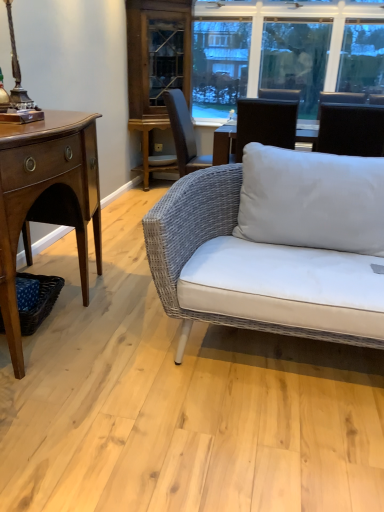
You are a GUI agent. You are given a task and a screenshot of the screen. Output one action in this format:
    pyautogui.click(x=<x>, y=<y>)
    Task: Click on the clear glass window at upper center
    This screenshot has height=512, width=384.
    Given the screenshot: What is the action you would take?
    pyautogui.click(x=274, y=49)

Locate an element on the screen. Image resolution: width=384 pixels, height=512 pixels. metallic bronze table lamp at upper left is located at coordinates coord(17,89).

Locate an element on the screen. mahogany wood desk at left is located at coordinates (46, 198).

What are the coordinates of `clear glass window at upper center` in the screenshot? It's located at (274, 49).

Is clear glass window at upper center wider or thinner than mahogany wood desk at left?

clear glass window at upper center is thinner than mahogany wood desk at left.

Is mahogany wood desk at left at the back of clear glass window at upper center?

No, mahogany wood desk at left is not at the back of clear glass window at upper center.

Who is taller, clear glass window at upper center or mahogany wood desk at left?

clear glass window at upper center is taller.

Measure the distance from clear glass window at upper center to mahogany wood desk at left.

clear glass window at upper center is 2.87 meters away from mahogany wood desk at left.

Is point (15, 104) positioned behind point (378, 108)?

No, it is in front of (378, 108).

Is metallic bronze table lamp at upper left in contact with black fabric chair at upper right?

No, metallic bronze table lamp at upper left is not touching black fabric chair at upper right.

Is metallic bronze table lamp at upper left oriented away from black fabric chair at upper right?

metallic bronze table lamp at upper left is not turned away from black fabric chair at upper right.

Considering the sizes of metallic bronze table lamp at upper left and black fabric chair at upper right in the image, is metallic bronze table lamp at upper left bigger or smaller than black fabric chair at upper right?

In the image, metallic bronze table lamp at upper left appears to be smaller than black fabric chair at upper right.

Is blue woven picnic basket at lower left at the right side of mahogany wood desk at left?

Yes.

You are a GUI agent. You are given a task and a screenshot of the screen. Output one action in this format:
    pyautogui.click(x=<x>, y=<y>)
    Task: Click on the desk above the blue woven picnic basket at lower left (from a real-world perspective)
    The height and width of the screenshot is (512, 384).
    Given the screenshot: What is the action you would take?
    pyautogui.click(x=46, y=198)

Can you confirm if blue woven picnic basket at lower left is smaller than mahogany wood desk at left?

Yes.

Is blue woven picnic basket at lower left looking in the opposite direction of mahogany wood desk at left?

Absolutely, blue woven picnic basket at lower left is directed away from mahogany wood desk at left.

Based on the photo, what's the angular difference between mahogany wood desk at left and metallic bronze table lamp at upper left's facing directions?

The facing directions of mahogany wood desk at left and metallic bronze table lamp at upper left are 0.000133 degrees apart.

Does mahogany wood desk at left touch metallic bronze table lamp at upper left?

No, mahogany wood desk at left is not making contact with metallic bronze table lamp at upper left.

Can you confirm if mahogany wood desk at left is bigger than metallic bronze table lamp at upper left?

Yes.

From a real-world perspective, is black fabric chair at upper right positioned over mahogany wood desk at left based on gravity?

Yes.

Find the location of `desk below the black fabric chair at upper right (from the image's perspective)`. desk below the black fabric chair at upper right (from the image's perspective) is located at coordinates pyautogui.click(x=46, y=198).

Is black fabric chair at upper right far from mahogany wood desk at left?

Absolutely, black fabric chair at upper right is distant from mahogany wood desk at left.

Considering the sizes of objects black fabric chair at upper right and mahogany wood desk at left in the image provided, who is bigger, black fabric chair at upper right or mahogany wood desk at left?

mahogany wood desk at left is bigger.

Measure the distance from metallic bronze table lamp at upper left to mahogany wood desk at left.

34.87 centimeters.

Who is smaller, metallic bronze table lamp at upper left or mahogany wood desk at left?

Smaller between the two is metallic bronze table lamp at upper left.

Does metallic bronze table lamp at upper left turn towards mahogany wood desk at left?

No, metallic bronze table lamp at upper left is not aimed at mahogany wood desk at left.

Is metallic bronze table lamp at upper left beside mahogany wood desk at left?

No, metallic bronze table lamp at upper left is not with mahogany wood desk at left.

Between clear glass window at upper center and metallic bronze table lamp at upper left, which one has larger size?

clear glass window at upper center is bigger.

From a real-world perspective, between clear glass window at upper center and metallic bronze table lamp at upper left, who is vertically lower?

metallic bronze table lamp at upper left is physically lower.

Which is behind, clear glass window at upper center or metallic bronze table lamp at upper left?

clear glass window at upper center is further from the camera.

Is metallic bronze table lamp at upper left completely or partially inside clear glass window at upper center?

No, metallic bronze table lamp at upper left is not surrounded by clear glass window at upper center.

Locate an element on the screen. This screenshot has width=384, height=512. desk lying on the left of clear glass window at upper center is located at coordinates (46, 198).

Identify the location of chair behind the metallic bronze table lamp at upper left. (351, 129).

Which object lies nearer to the anchor point wooden cabinet at center, metallic bronze table lamp at upper left or mahogany wood desk at left?

mahogany wood desk at left is positioned closer to the anchor wooden cabinet at center.

Based on their spatial positions, is metallic bronze table lamp at upper left or blue woven picnic basket at lower left further from mahogany wood desk at left?

metallic bronze table lamp at upper left is further to mahogany wood desk at left.

Considering their positions, is wooden cabinet at center positioned further to blue woven picnic basket at lower left than clear glass window at upper center?

Among the two, clear glass window at upper center is located further to blue woven picnic basket at lower left.

Considering their positions, is clear glass window at upper center positioned further to metallic bronze table lamp at upper left than blue woven picnic basket at lower left?

The object further to metallic bronze table lamp at upper left is clear glass window at upper center.

Estimate the real-world distances between objects in this image. Which object is closer to mahogany wood desk at left, black fabric chair at upper right or clear glass window at upper center?

The object closer to mahogany wood desk at left is black fabric chair at upper right.

Looking at the image, which one is located further to black fabric chair at upper right, blue woven picnic basket at lower left or metallic bronze table lamp at upper left?

Among the two, blue woven picnic basket at lower left is located further to black fabric chair at upper right.

Which object lies further to the anchor point mahogany wood desk at left, clear glass window at upper center or wooden cabinet at center?

clear glass window at upper center is further to mahogany wood desk at left.

In the scene shown: From the image, which object appears to be farther from mahogany wood desk at left, blue woven picnic basket at lower left or metallic bronze table lamp at upper left?

Among the two, metallic bronze table lamp at upper left is located further to mahogany wood desk at left.

Identify the location of chair between metallic bronze table lamp at upper left and clear glass window at upper center from front to back. (351, 129).

The width and height of the screenshot is (384, 512). Identify the location of picnic basket located between mahogany wood desk at left and wooden cabinet at center in the depth direction. (40, 302).

Where is `cabinetry between clear glass window at upper center and blue woven picnic basket at lower left in the up-down direction`? The image size is (384, 512). cabinetry between clear glass window at upper center and blue woven picnic basket at lower left in the up-down direction is located at coordinates (156, 69).

You are a GUI agent. You are given a task and a screenshot of the screen. Output one action in this format:
    pyautogui.click(x=<x>, y=<y>)
    Task: Click on the cabinetry between black fabric chair at upper right and clear glass window at upper center along the z-axis
    
    Given the screenshot: What is the action you would take?
    pyautogui.click(x=156, y=69)